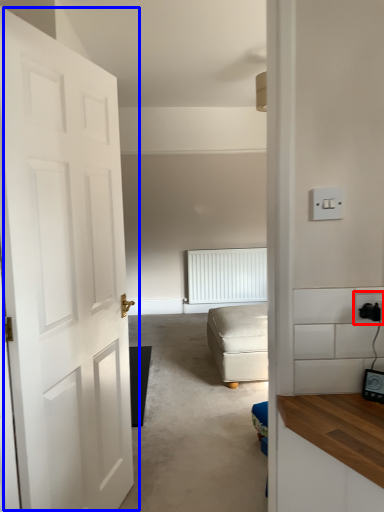
Question: Among these objects, which one is nearest to the camera, electric outlet (highlighted by a red box) or door (highlighted by a blue box)?

Choices:
 (A) electric outlet
 (B) door

Answer: (B)